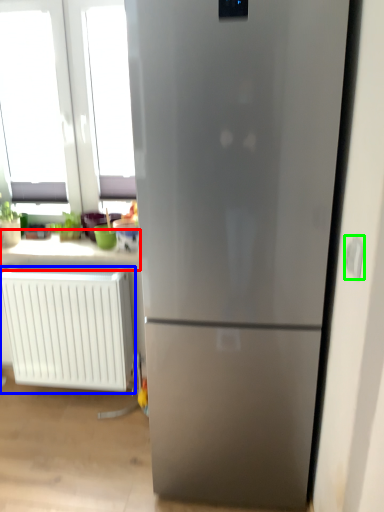
Question: Which object is positioned farthest from counter top (highlighted by a red box)? Select from radiator (highlighted by a blue box) and electric outlet (highlighted by a green box).

Choices:
 (A) radiator
 (B) electric outlet

Answer: (B)